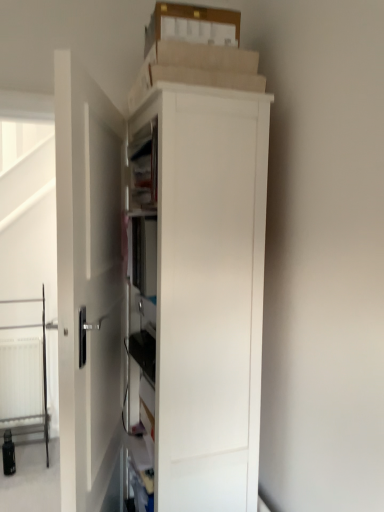
Question: Is transparent glass screen door at left far away from white plastic radiator at lower left?

Choices:
 (A) yes
 (B) no

Answer: (B)

Question: Is the position of transparent glass screen door at left more distant than that of white plastic radiator at lower left?

Choices:
 (A) no
 (B) yes

Answer: (A)

Question: Is transparent glass screen door at left taller than white plastic radiator at lower left?

Choices:
 (A) yes
 (B) no

Answer: (A)

Question: From the image's perspective, does transparent glass screen door at left appear higher than white plastic radiator at lower left?

Choices:
 (A) no
 (B) yes

Answer: (B)

Question: Considering the relative sizes of transparent glass screen door at left and white plastic radiator at lower left in the image provided, is transparent glass screen door at left smaller than white plastic radiator at lower left?

Choices:
 (A) no
 (B) yes

Answer: (A)

Question: Is transparent glass screen door at left bigger than white plastic radiator at lower left?

Choices:
 (A) no
 (B) yes

Answer: (B)

Question: Considering the relative sizes of white plastic radiator at lower left and white matte cabinet at center in the image provided, is white plastic radiator at lower left wider than white matte cabinet at center?

Choices:
 (A) yes
 (B) no

Answer: (B)

Question: Is white plastic radiator at lower left oriented away from white matte cabinet at center?

Choices:
 (A) yes
 (B) no

Answer: (B)

Question: From a real-world perspective, is white plastic radiator at lower left beneath white matte cabinet at center?

Choices:
 (A) yes
 (B) no

Answer: (A)

Question: Is white plastic radiator at lower left taller than white matte cabinet at center?

Choices:
 (A) yes
 (B) no

Answer: (B)

Question: Is white plastic radiator at lower left closer to the viewer compared to white matte cabinet at center?

Choices:
 (A) yes
 (B) no

Answer: (B)

Question: Considering the relative sizes of white plastic radiator at lower left and white matte cabinet at center in the image provided, is white plastic radiator at lower left bigger than white matte cabinet at center?

Choices:
 (A) no
 (B) yes

Answer: (A)

Question: Does white matte cabinet at center have a lesser width compared to white smooth door at center?

Choices:
 (A) no
 (B) yes

Answer: (A)